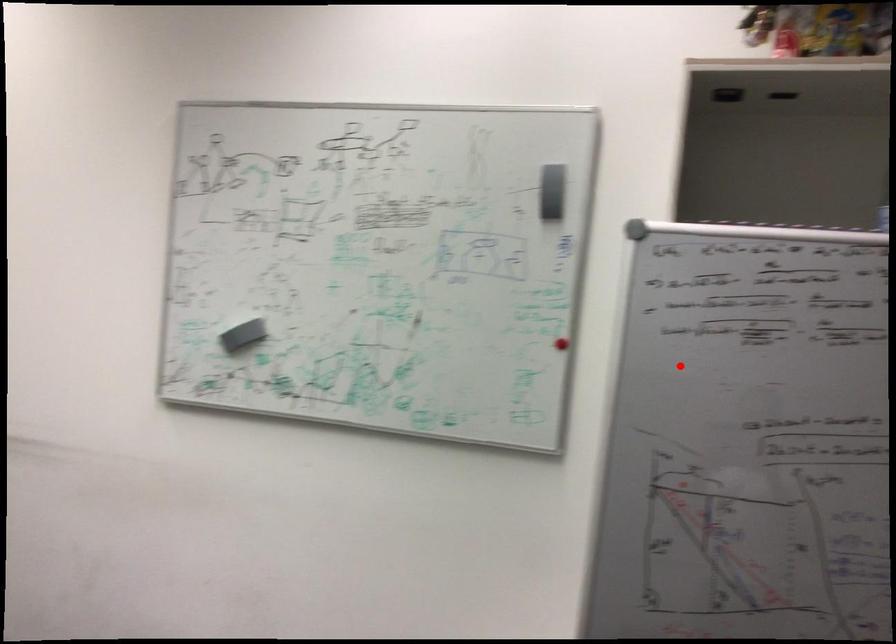
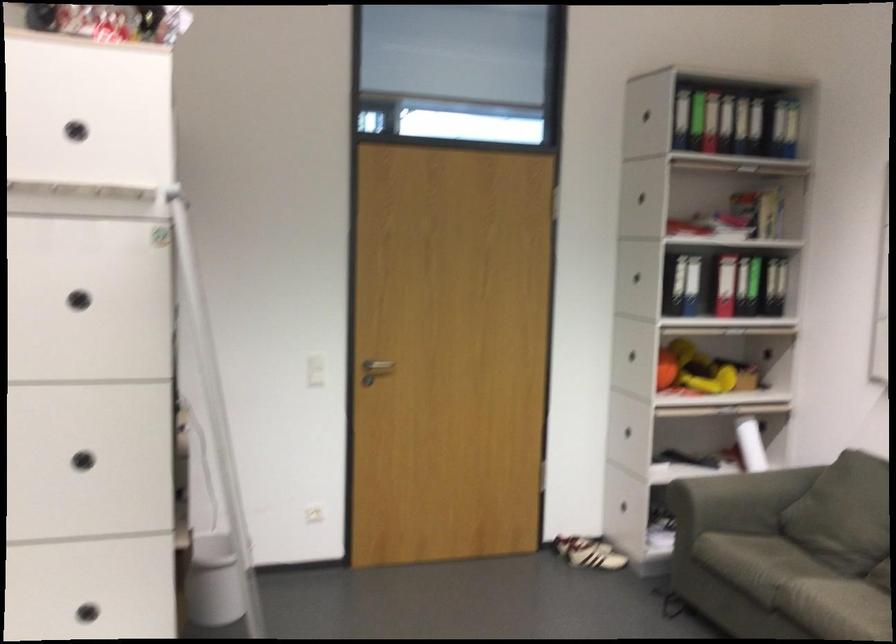
Question: I am providing you with two images of the same scene from different viewpoints. A red point is marked on the first image. Can you still see the location of the red point in image 2?

Choices:
 (A) Yes
 (B) No

Answer: (A)